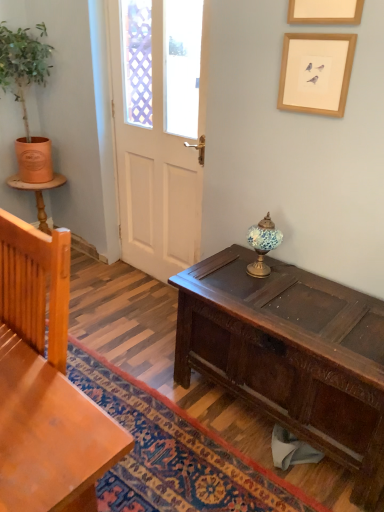
Question: Does light brown wood chair at left have a smaller size compared to orange clay pot at left?

Choices:
 (A) no
 (B) yes

Answer: (B)

Question: Is orange clay pot at left at the back of light brown wood chair at left?

Choices:
 (A) yes
 (B) no

Answer: (B)

Question: Can you confirm if light brown wood chair at left is shorter than orange clay pot at left?

Choices:
 (A) yes
 (B) no

Answer: (A)

Question: Would you say light brown wood chair at left is a long distance from orange clay pot at left?

Choices:
 (A) no
 (B) yes

Answer: (B)

Question: Considering the relative sizes of light brown wood chair at left and orange clay pot at left in the image provided, is light brown wood chair at left wider than orange clay pot at left?

Choices:
 (A) no
 (B) yes

Answer: (A)

Question: From their relative heights in the image, would you say white matte door at center is taller or shorter than light brown wood chair at left?

Choices:
 (A) short
 (B) tall

Answer: (B)

Question: From the image's perspective, relative to light brown wood chair at left, is white matte door at center above or below?

Choices:
 (A) below
 (B) above

Answer: (B)

Question: Looking at their shapes, would you say white matte door at center is wider or thinner than light brown wood chair at left?

Choices:
 (A) thin
 (B) wide

Answer: (A)

Question: Would you say white matte door at center is inside or outside light brown wood chair at left?

Choices:
 (A) inside
 (B) outside

Answer: (B)

Question: Considering the positions of dark brown wood desk at center and orange clay pot at left in the image, is dark brown wood desk at center wider or thinner than orange clay pot at left?

Choices:
 (A) wide
 (B) thin

Answer: (A)

Question: From a real-world perspective, is dark brown wood desk at center above or below orange clay pot at left?

Choices:
 (A) below
 (B) above

Answer: (A)

Question: Based on their positions, is dark brown wood desk at center located to the left or right of orange clay pot at left?

Choices:
 (A) left
 (B) right

Answer: (B)

Question: Which is correct: dark brown wood desk at center is inside orange clay pot at left, or outside of it?

Choices:
 (A) inside
 (B) outside

Answer: (B)

Question: Is orange clay pot at left in front of or behind light brown wood chair at left in the image?

Choices:
 (A) behind
 (B) front

Answer: (A)

Question: In terms of width, does orange clay pot at left look wider or thinner when compared to light brown wood chair at left?

Choices:
 (A) wide
 (B) thin

Answer: (A)